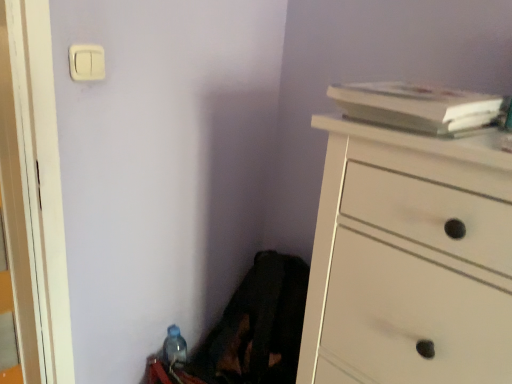
Question: Could white matte book at upper right be considered to be inside white wood chest of drawers at right?

Choices:
 (A) no
 (B) yes

Answer: (A)

Question: Is white wood chest of drawers at right wider than white matte book at upper right?

Choices:
 (A) no
 (B) yes

Answer: (B)

Question: Can you confirm if white wood chest of drawers at right is bigger than white matte book at upper right?

Choices:
 (A) yes
 (B) no

Answer: (A)

Question: Is white wood chest of drawers at right closer to camera compared to white matte book at upper right?

Choices:
 (A) yes
 (B) no

Answer: (A)

Question: From the image's perspective, is white wood chest of drawers at right on white matte book at upper right?

Choices:
 (A) no
 (B) yes

Answer: (A)

Question: Is white matte book at upper right inside the boundaries of white plastic light switch at upper left, or outside?

Choices:
 (A) inside
 (B) outside

Answer: (B)

Question: Considering the positions of white matte book at upper right and white plastic light switch at upper left in the image, is white matte book at upper right bigger or smaller than white plastic light switch at upper left?

Choices:
 (A) small
 (B) big

Answer: (B)

Question: Does point (400, 86) appear closer or farther from the camera than point (102, 54)?

Choices:
 (A) closer
 (B) farther

Answer: (A)

Question: Relative to white plastic light switch at upper left, is white matte book at upper right in front or behind?

Choices:
 (A) front
 (B) behind

Answer: (A)

Question: Considering the positions of white wood chest of drawers at right and translucent plastic bottle at lower left in the image, is white wood chest of drawers at right wider or thinner than translucent plastic bottle at lower left?

Choices:
 (A) wide
 (B) thin

Answer: (A)

Question: In terms of size, does white wood chest of drawers at right appear bigger or smaller than translucent plastic bottle at lower left?

Choices:
 (A) big
 (B) small

Answer: (A)

Question: From the image's perspective, is white wood chest of drawers at right located above or below translucent plastic bottle at lower left?

Choices:
 (A) above
 (B) below

Answer: (A)

Question: Considering the positions of white wood chest of drawers at right and translucent plastic bottle at lower left in the image, is white wood chest of drawers at right taller or shorter than translucent plastic bottle at lower left?

Choices:
 (A) tall
 (B) short

Answer: (A)

Question: Is point 168,331 positioned closer to the camera than point 79,52?

Choices:
 (A) farther
 (B) closer

Answer: (A)

Question: Considering their positions, is translucent plastic bottle at lower left located in front of or behind white plastic light switch at upper left?

Choices:
 (A) behind
 (B) front

Answer: (A)